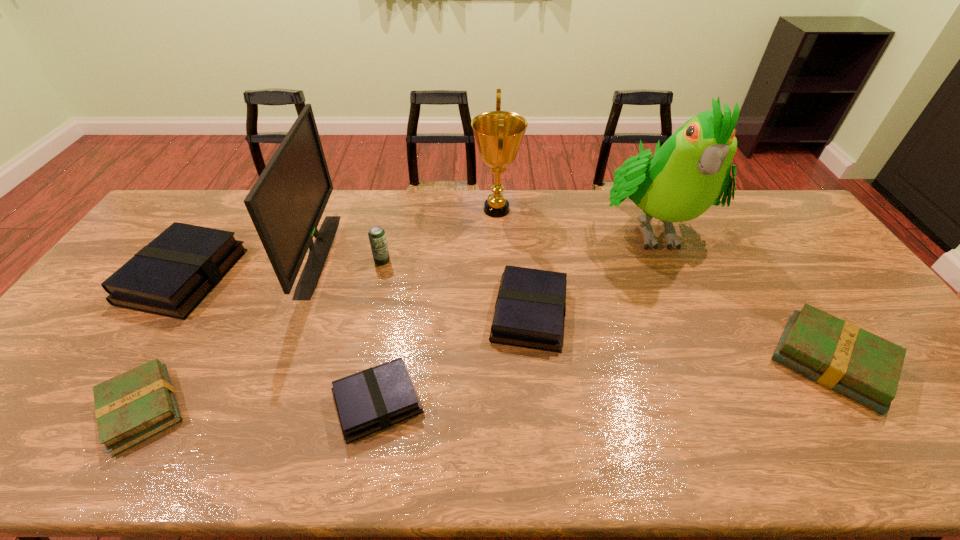
Locate an element on the screen. The image size is (960, 540). free space located 0.250m on the right of the leftmost blue book is located at coordinates (316, 276).

Image resolution: width=960 pixels, height=540 pixels. Identify the location of vacant area situated on the left of the second book from right to left. (359, 313).

Identify the location of vacant region located 0.140m on the left of the rightmost book. This screenshot has width=960, height=540. (715, 362).

Image resolution: width=960 pixels, height=540 pixels. In order to click on vacant space situated on the right of the third book from left to right in this screenshot , I will do `click(485, 402)`.

What are the coordinates of `free space located 0.330m on the back of the smaller yellow book` in the screenshot? It's located at (221, 274).

I want to click on parakeet that is positioned at the far edge, so click(x=683, y=179).

Find the location of a particular element. The height and width of the screenshot is (540, 960). award that is at the far edge is located at coordinates point(498,134).

This screenshot has height=540, width=960. Find the location of `monitor that is at the far edge`. monitor that is at the far edge is located at coordinates (286, 203).

You are a GUI agent. You are given a task and a screenshot of the screen. Output one action in this format:
    pyautogui.click(x=<x>, y=<y>)
    Task: Click on the object that is at the left edge
    This screenshot has height=540, width=960.
    Given the screenshot: What is the action you would take?
    pyautogui.click(x=170, y=276)

Locate an element on the screen. This screenshot has height=540, width=960. object present at the right edge is located at coordinates (866, 368).